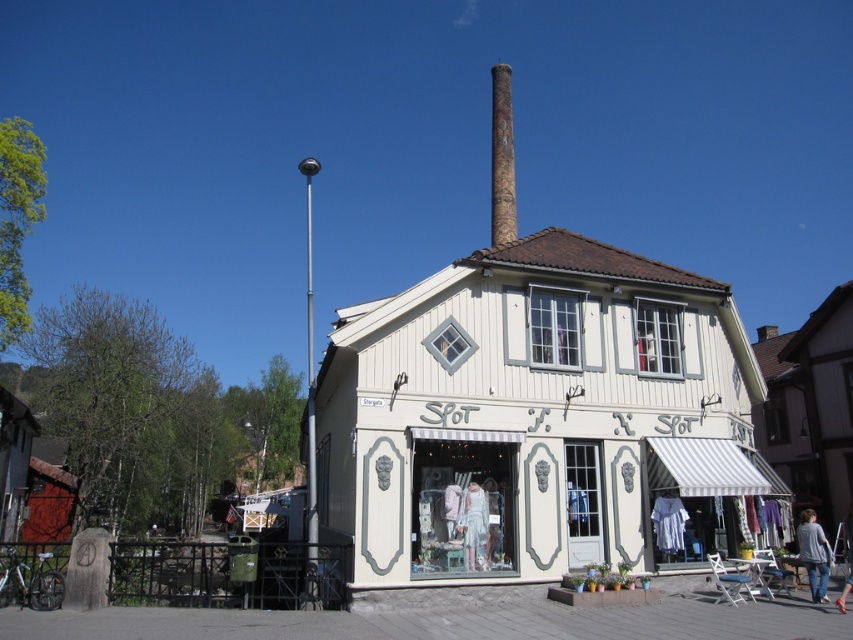
You are standing in front of the two story building and see the rusty metal chimney at center and the gray sweater at lower right. Which object is closer to you?

The rusty metal chimney at center is closer to you because the gray sweater at lower right is behind it.